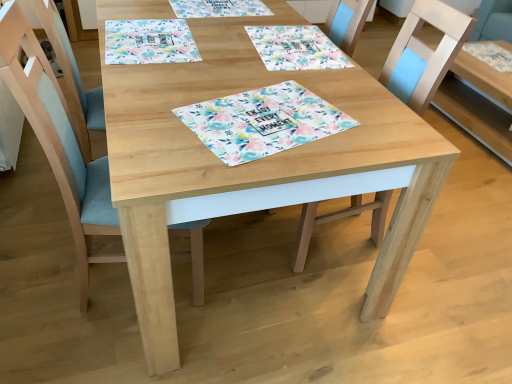
Find the location of a particular element. free space below floral paper placemat at center (from a real-world perspective) is located at coordinates (270, 120).